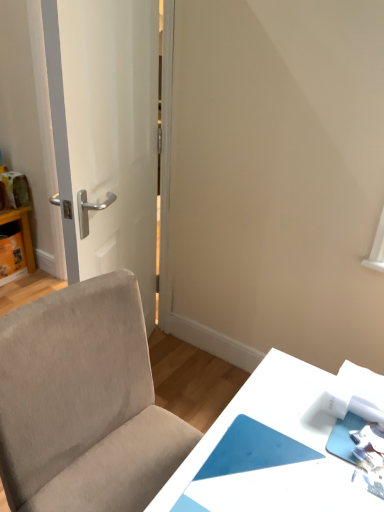
Question: Is beige fabric chair at lower left taller or shorter than matte cardboard box at left, which is the second table from right to left?

Choices:
 (A) tall
 (B) short

Answer: (A)

Question: Is beige fabric chair at lower left wider or thinner than matte cardboard box at left, which appears as the first table when viewed from the back?

Choices:
 (A) wide
 (B) thin

Answer: (A)

Question: Which object is the farthest from the matte cardboard box at left, which appears as the first table when viewed from the back?

Choices:
 (A) beige fabric chair at lower left
 (B) white glossy table at lower right, which is the 2th table in top-to-bottom order
 (C) white glossy door at left

Answer: (B)

Question: Estimate the real-world distances between objects in this image. Which object is farther from the matte cardboard box at left, which is the second table from right to left?

Choices:
 (A) white glossy table at lower right, which is counted as the 2th table, starting from the back
 (B) beige fabric chair at lower left
 (C) white glossy door at left

Answer: (A)